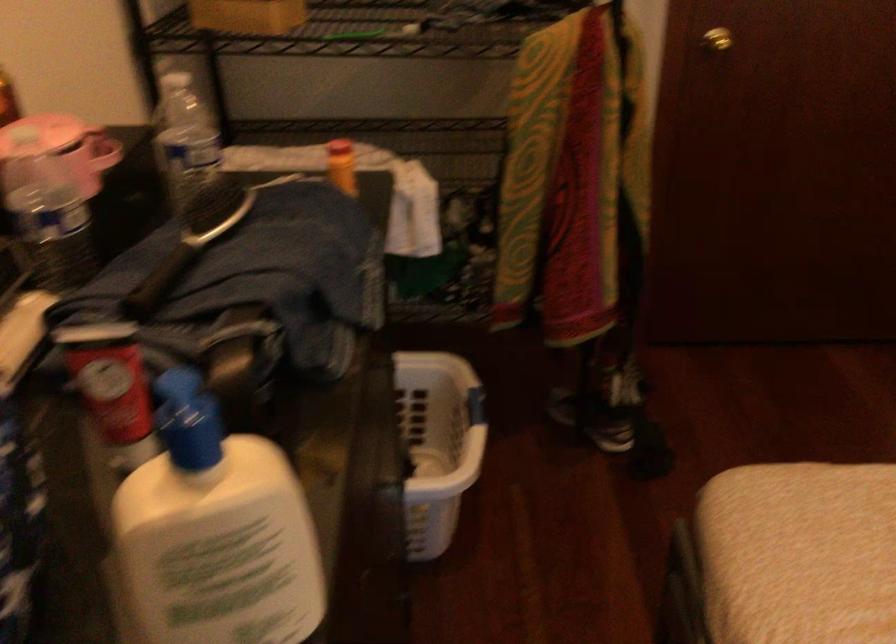
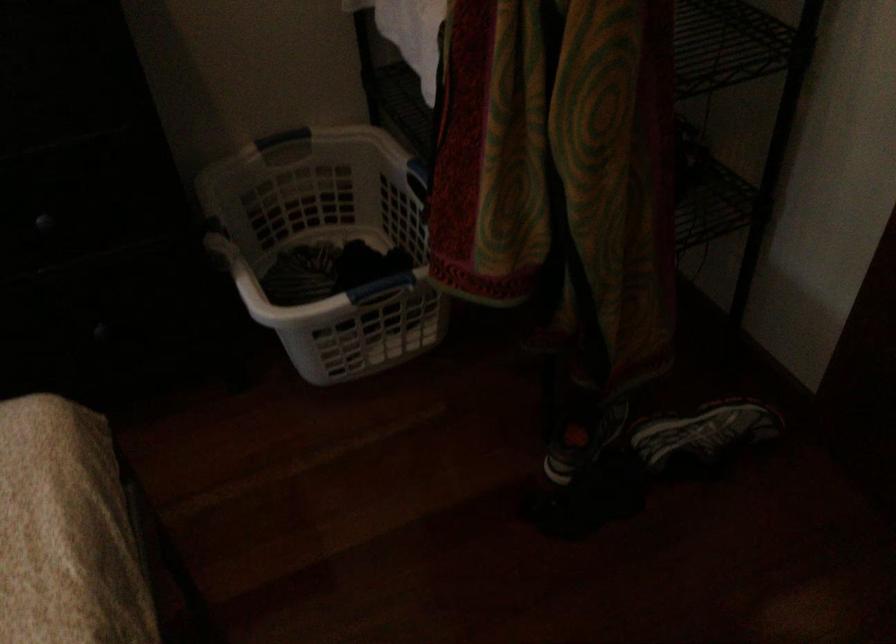
Locate, in the second image, the point that corresponds to point 640,366 in the first image.

(702, 436)